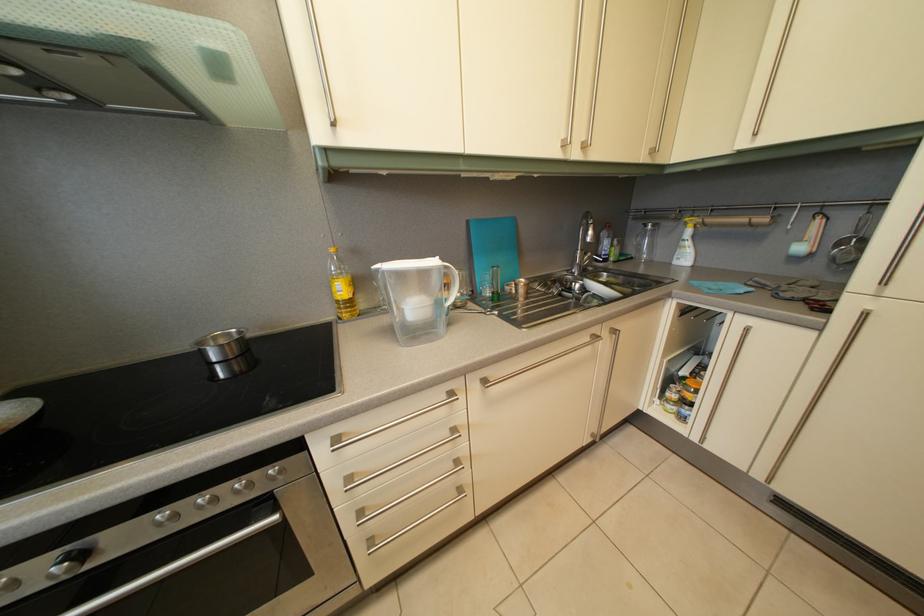
Image resolution: width=924 pixels, height=616 pixels. What do you see at coordinates (341, 286) in the screenshot?
I see `a yellow oil bottle` at bounding box center [341, 286].